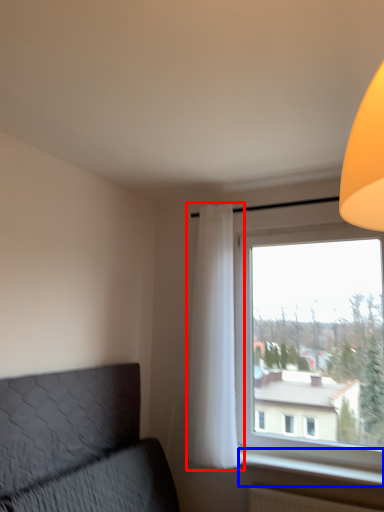
Question: Which point is closer to the camera, curtain (highlighted by a red box) or window sill (highlighted by a blue box)?

Choices:
 (A) curtain
 (B) window sill

Answer: (B)